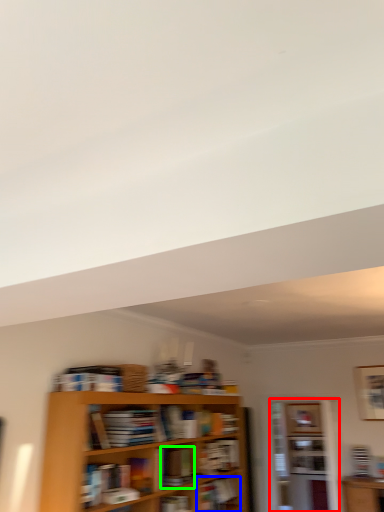
Question: Estimate the real-world distances between objects in this image. Which object is farther from shelf (highlighted by a red box), book (highlighted by a blue box) or book (highlighted by a green box)?

Choices:
 (A) book
 (B) book

Answer: (B)